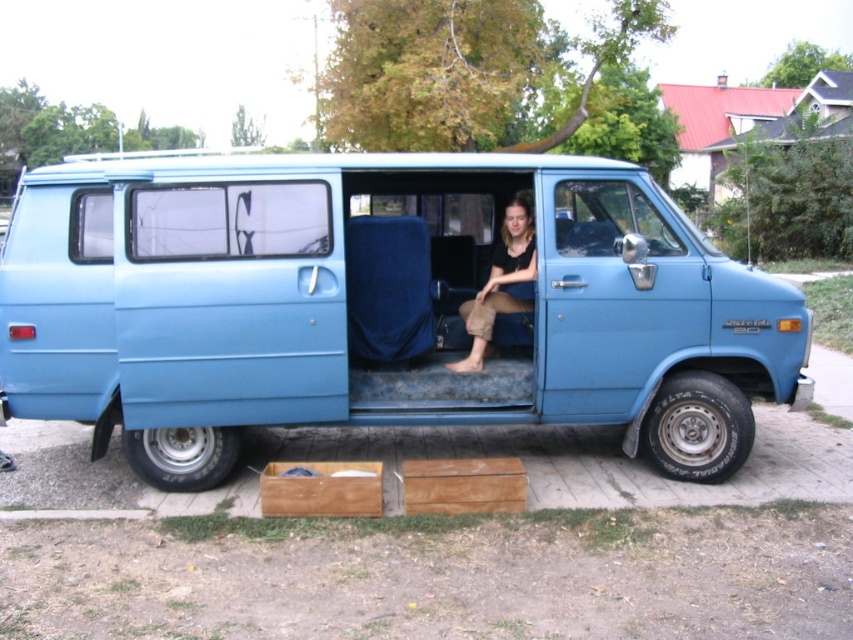
You are standing at the origin point in a parking lot and see the blue matte van at center. What are the coordinates of the van relative to your position?

The blue matte van at center is located at point coordinates of [381,305].

You are a delivery person who needs to load a package onto the roof of the blue matte van at center. The package is 1.2 meters tall. Considering the height of the matte black shirt at center, which is worn by a person sitting inside the van, can you estimate if the package will fit on the roof without exceeding the van height?

The blue matte van at center is taller than the matte black shirt at center. Since the package is 1.2 meters tall, and the van is higher than the shirt, the package should fit on the roof as long as the shirt height is less than the package height. However, without exact measurements, this is an approximation.

You are a delivery driver who needs to load a package into the blue matte van at center. However, there is a person wearing a matte black shirt at center blocking the entrance. From the driver perspective, is the person in front of the van or behind it?

The blue matte van at center is in front of the matte black shirt at center, so the person wearing the matte black shirt at center is behind the van from the driver perspective.